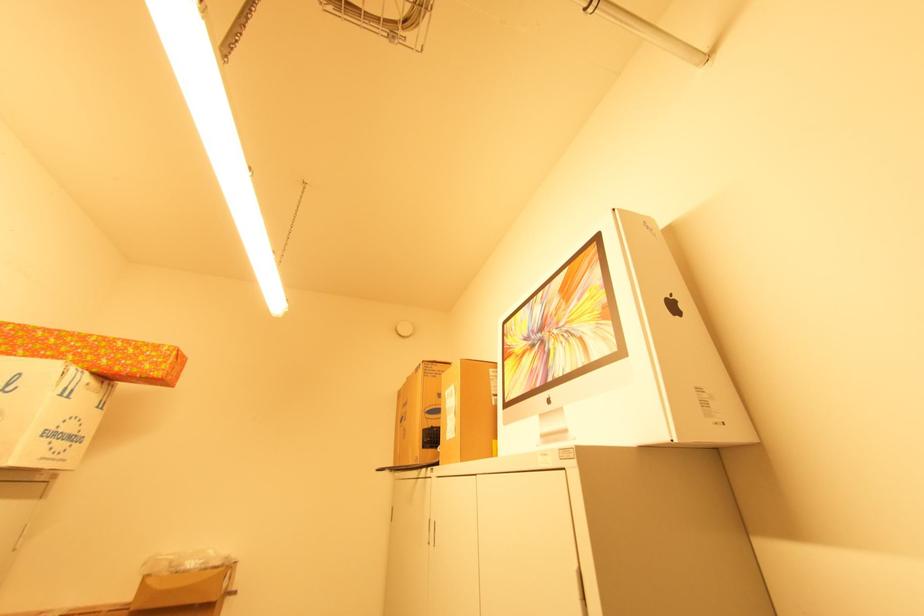
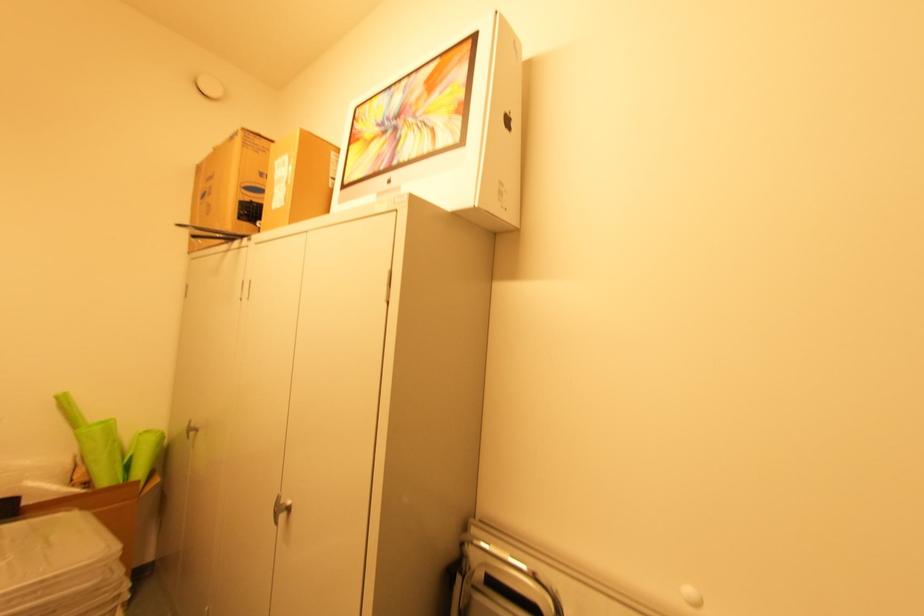
In the second image, find the point that corresponds to [507,363] in the first image.

(353, 148)